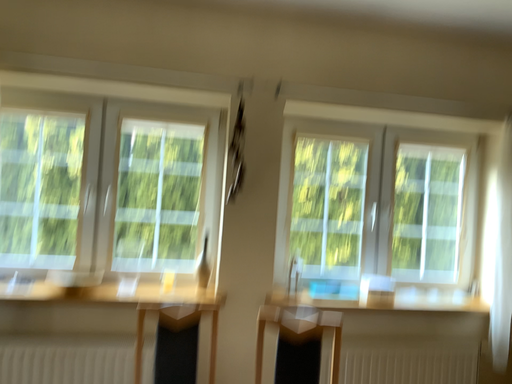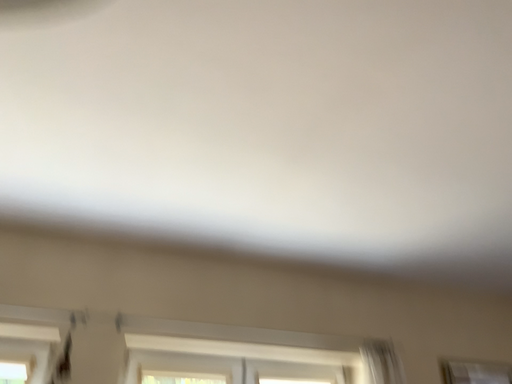
Question: Which way did the camera rotate in the video?

Choices:
 (A) rotated upward
 (B) rotated downward

Answer: (A)